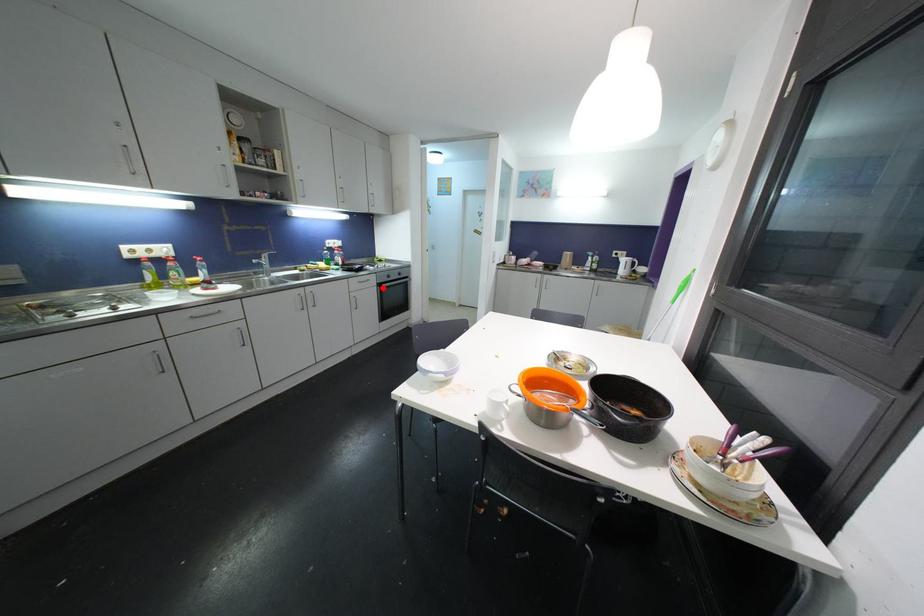
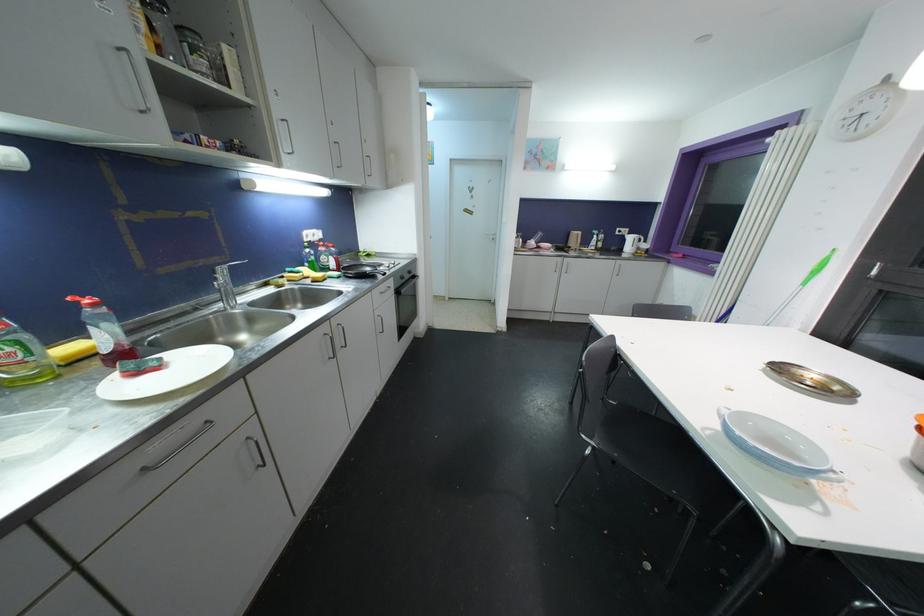
Question: I am providing you with two images of the same scene from different viewpoints. A red point is shown in image1. For the corresponding object point in image2, is it positioned nearer or farther from the camera?

Choices:
 (A) Nearer
 (B) Farther

Answer: (A)